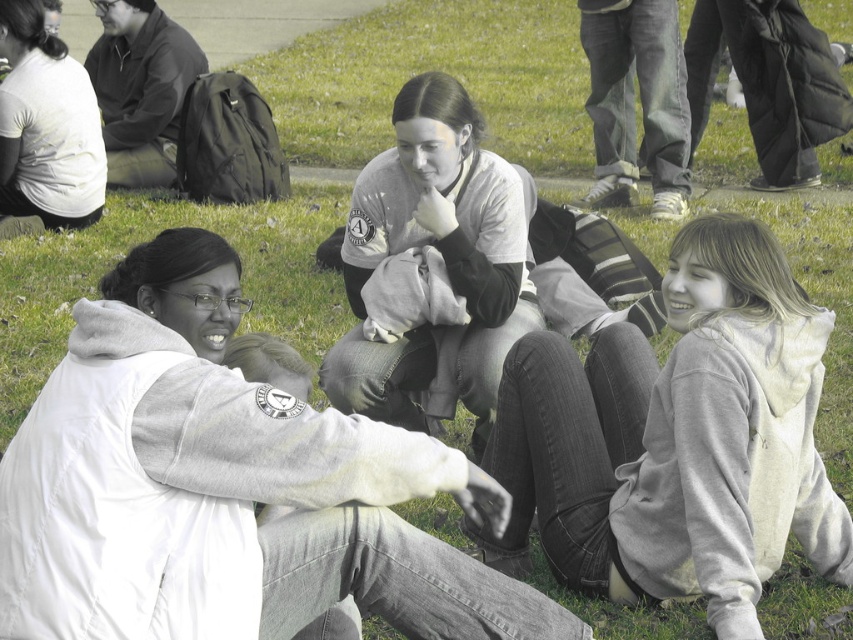
Question: Which point is closer to the camera taking this photo?

Choices:
 (A) (508, 248)
 (B) (160, 388)

Answer: (B)

Question: Which of these objects is positioned farthest from the white cotton shirt at center?

Choices:
 (A) gray cotton hoodie at lower right
 (B) white fleece jacket at lower left

Answer: (B)

Question: Does white fleece jacket at lower left have a larger size compared to white matte t-shirt at upper left?

Choices:
 (A) yes
 (B) no

Answer: (A)

Question: Is gray cotton hoodie at lower right to the left of white matte t-shirt at upper left from the viewer's perspective?

Choices:
 (A) no
 (B) yes

Answer: (A)

Question: Considering the real-world distances, which object is closest to the white matte t-shirt at upper left?

Choices:
 (A) white cotton shirt at center
 (B) gray cotton hoodie at lower right
 (C) white fleece jacket at lower left

Answer: (A)

Question: Can you confirm if white fleece jacket at lower left is positioned below gray cotton hoodie at lower right?

Choices:
 (A) no
 (B) yes

Answer: (A)